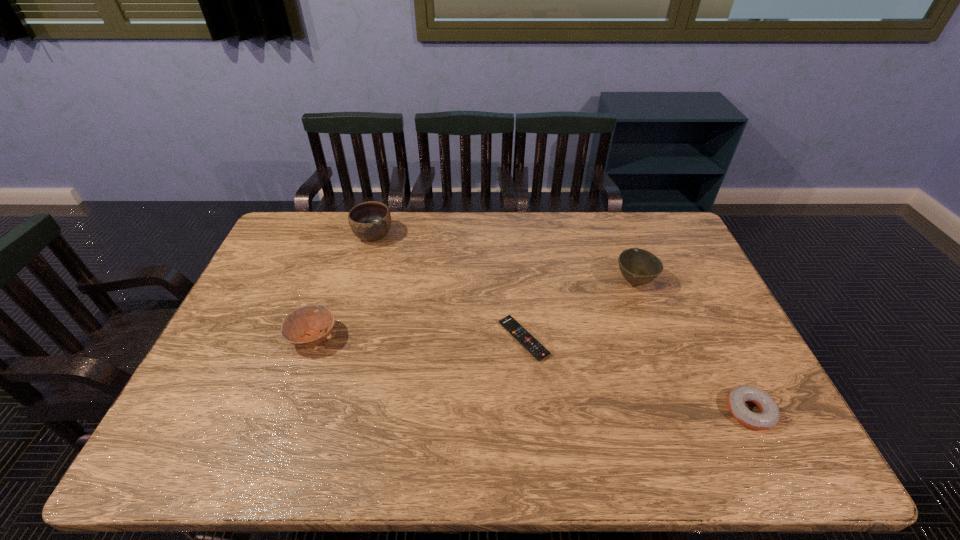
I want to click on unoccupied position between the third object from left to right and the rightmost object, so click(636, 375).

Identify the location of vacant area that lies between the nearest bowl and the farthest object. The image size is (960, 540). (344, 286).

This screenshot has height=540, width=960. I want to click on vacant space that is in between the farthest bowl and the second shortest object, so click(x=562, y=323).

Find the location of a particular element. free space between the second nearest bowl and the nearest bowl is located at coordinates (474, 309).

At what (x,y) coordinates should I click in order to perform the action: click on unoccupied position between the nearest object and the shortest bowl. Please return your answer as a coordinate pair (x, y). This screenshot has width=960, height=540. Looking at the image, I should click on (532, 374).

Choose which object is the second nearest neighbor to the shortest object. Please provide its 2D coordinates. Your answer should be formatted as a tuple, i.e. [(x, y)], where the tuple contains the x and y coordinates of a point satisfying the conditions above.

[(769, 416)]

Image resolution: width=960 pixels, height=540 pixels. What are the coordinates of `the second closest object relative to the shortest object` in the screenshot? It's located at (769, 416).

Locate an element on the screen. Image resolution: width=960 pixels, height=540 pixels. bowl object that ranks as the closest to the farthest object is located at coordinates (302, 327).

Where is `the second closest bowl to the second nearest bowl`? Image resolution: width=960 pixels, height=540 pixels. the second closest bowl to the second nearest bowl is located at coordinates (302, 327).

Where is `vacant space that satisfies the following two spatial constraints: 1. on the back side of the third tallest object; 2. on the left side of the rightmost bowl`? This screenshot has width=960, height=540. vacant space that satisfies the following two spatial constraints: 1. on the back side of the third tallest object; 2. on the left side of the rightmost bowl is located at coordinates (333, 282).